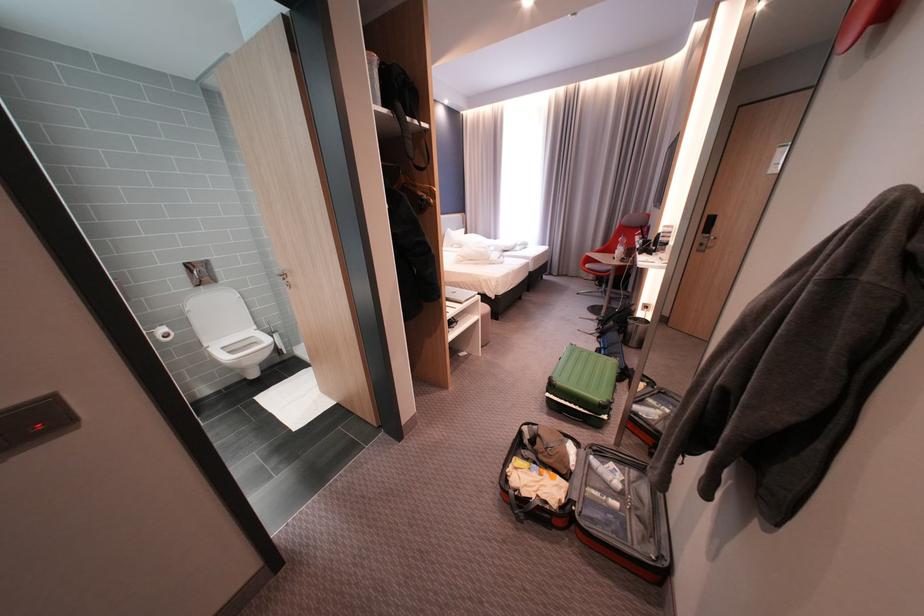
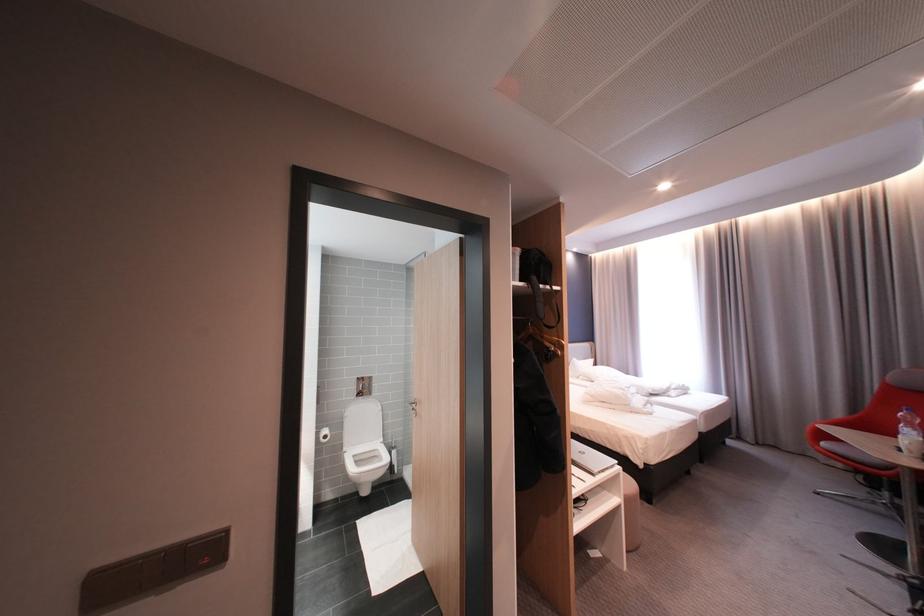
Based on the continuous images, in which direction is the camera rotating?

The rotation direction of the camera is left-up.